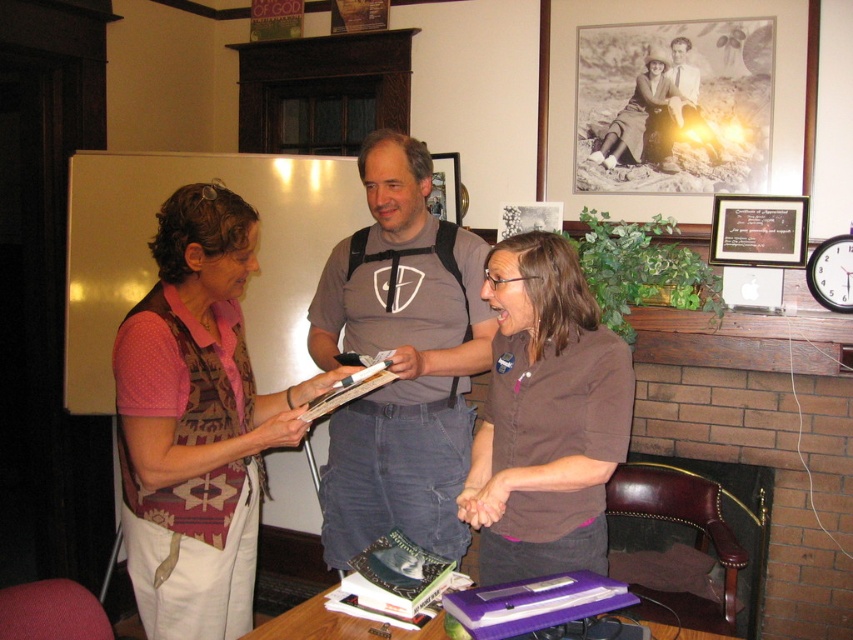
Question: Is pink woven vest at left positioned at the back of hardcover book at center?

Choices:
 (A) yes
 (B) no

Answer: (B)

Question: Is brown matte shirt at center wider than purple plastic book at lower center?

Choices:
 (A) yes
 (B) no

Answer: (A)

Question: Which of the following is the farthest from the observer?

Choices:
 (A) hardcover book at center
 (B) purple plastic book at lower center
 (C) matte black picture frame at upper right
 (D) brown matte shirt at center

Answer: (C)

Question: Estimate the real-world distances between objects in this image. Which object is farther from the black matte picture frame at upper center?

Choices:
 (A) brown matte shirt at center
 (B) pink woven vest at left
 (C) hardcover book at center
 (D) wooden picture frame at upper center

Answer: (B)

Question: Which object appears closest to the camera in this image?

Choices:
 (A) matte black dress at center
 (B) pink woven vest at left
 (C) brown cotton t-shirt at center

Answer: (B)

Question: Does purple plastic book at lower center have a lesser width compared to wooden picture frame at upper center?

Choices:
 (A) yes
 (B) no

Answer: (B)